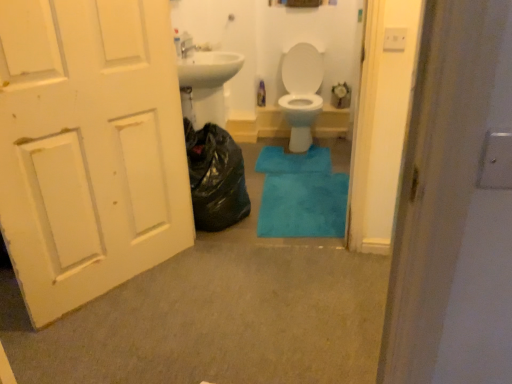
This screenshot has width=512, height=384. What are the coordinates of `free space above blue plush bath mat at center, which is counted as the 2th bath mat, starting from the top (from a real-world perspective)` in the screenshot? It's located at (302, 189).